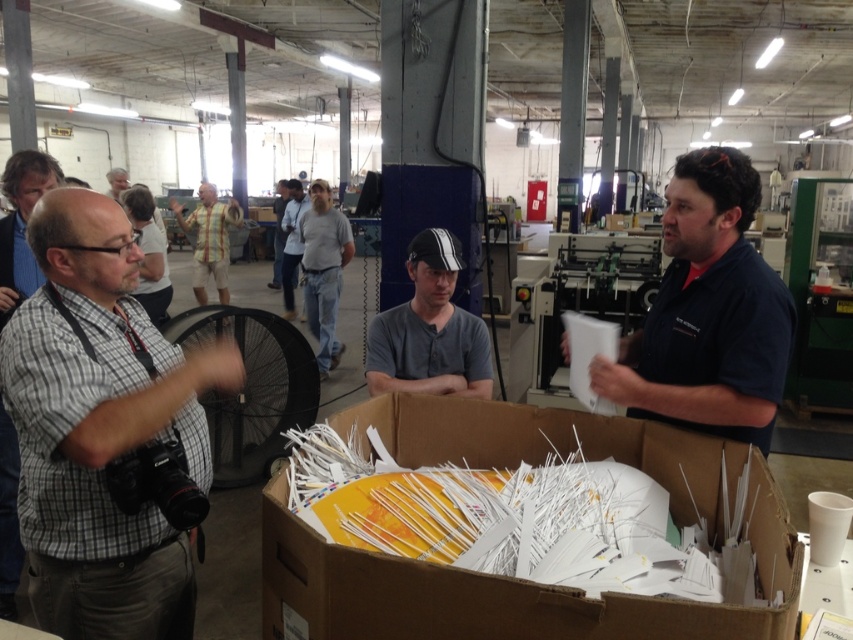
Question: Based on their relative distances, which object is farther from the gray fabric shirt at upper left?

Choices:
 (A) white cardboard box at center
 (B) dark gray shirt at center
 (C) gray checkered shirt at left

Answer: (A)

Question: Which of the following is the farthest from the observer?

Choices:
 (A) light blue shirt at center
 (B) gray fabric shirt at upper left
 (C) gray cotton shirt at center

Answer: (C)

Question: Where is yellow striped shirt at upper center located in relation to light blue shirt at center in the image?

Choices:
 (A) right
 (B) left

Answer: (B)

Question: Which object is closer to the camera taking this photo?

Choices:
 (A) gray cotton shirt at center
 (B) light blue shirt at center

Answer: (B)

Question: Is the position of white cardboard box at center more distant than that of dark gray shirt at center?

Choices:
 (A) yes
 (B) no

Answer: (B)

Question: Does gray checkered shirt at left appear over gray cotton shirt at center?

Choices:
 (A) yes
 (B) no

Answer: (B)